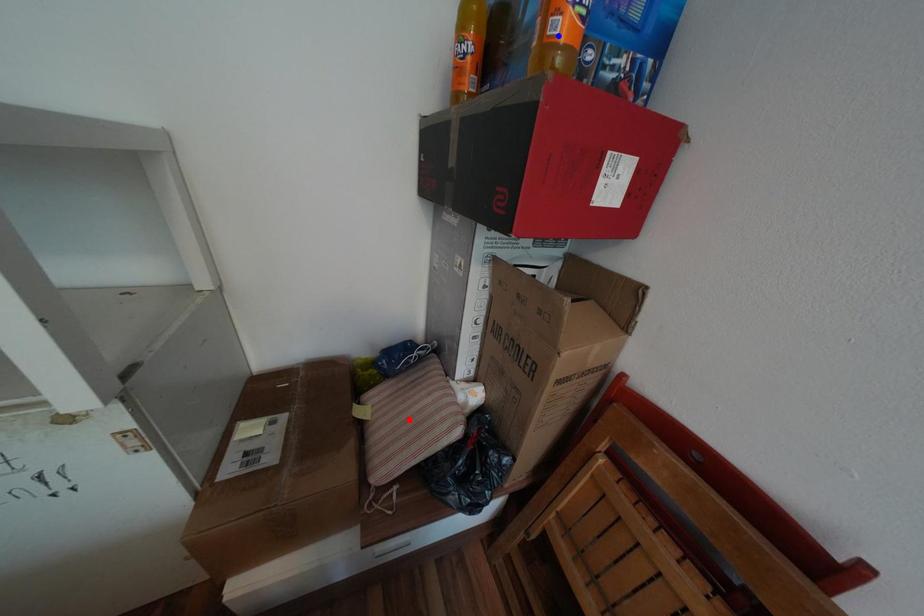
Question: In the image, two points are highlighted. Which point is nearer to the camera? Reply with the corresponding letter.

Choices:
 (A) blue point
 (B) red point

Answer: (A)